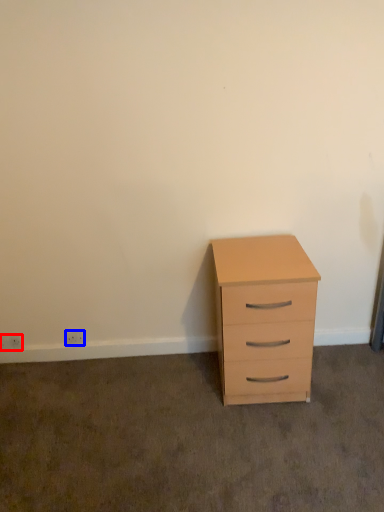
Question: Among these objects, which one is farthest to the camera, electric outlet (highlighted by a red box) or electric outlet (highlighted by a blue box)?

Choices:
 (A) electric outlet
 (B) electric outlet

Answer: (A)